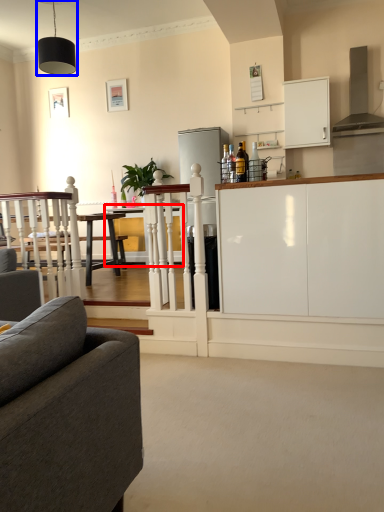
Question: Which of the following is the farthest to the observer, table (highlighted by a red box) or light fixture (highlighted by a blue box)?

Choices:
 (A) table
 (B) light fixture

Answer: (A)